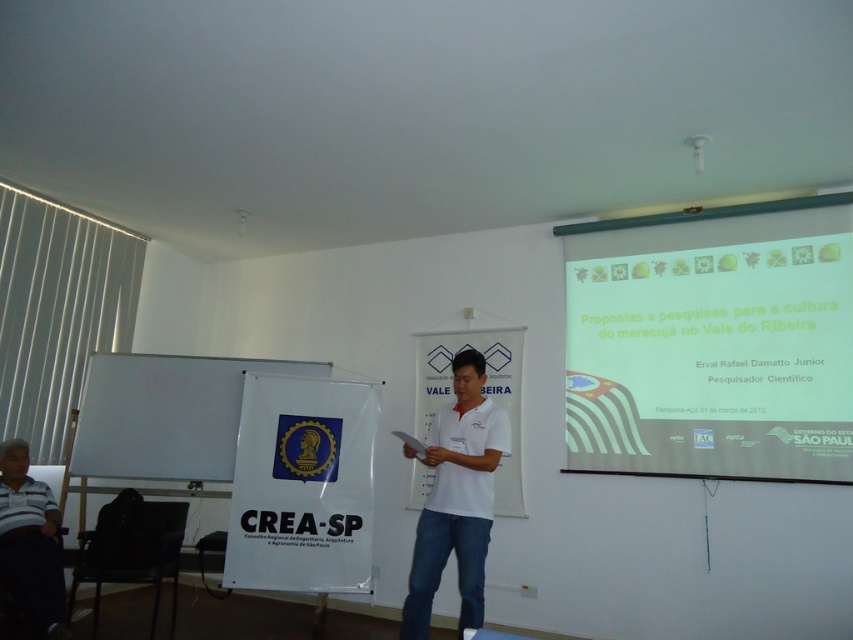
Question: Is white matte shirt at center positioned before dark striped shirt at lower left?

Choices:
 (A) yes
 (B) no

Answer: (A)

Question: Does white matte shirt at center come behind dark striped shirt at lower left?

Choices:
 (A) yes
 (B) no

Answer: (B)

Question: Is white matte projector screen at upper right to the left of white matte shirt at center from the viewer's perspective?

Choices:
 (A) yes
 (B) no

Answer: (B)

Question: Among these objects, which one is farthest from the camera?

Choices:
 (A) dark striped shirt at lower left
 (B) white matte shirt at center
 (C) white matte projector screen at upper right

Answer: (C)

Question: Which point appears closest to the camera in this image?

Choices:
 (A) pyautogui.click(x=32, y=627)
 (B) pyautogui.click(x=497, y=424)

Answer: (B)

Question: Estimate the real-world distances between objects in this image. Which object is farther from the white matte projector screen at upper right?

Choices:
 (A) dark striped shirt at lower left
 (B) white matte shirt at center

Answer: (A)